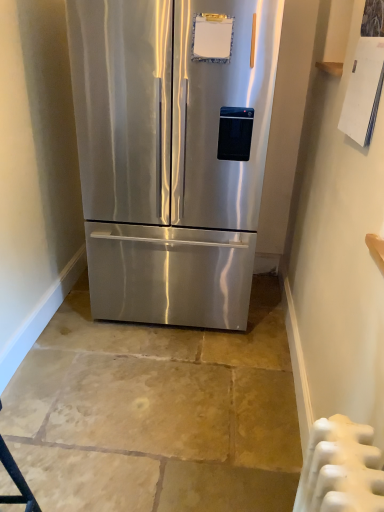
Image resolution: width=384 pixels, height=512 pixels. I want to click on free space in front of stainless steel refrigerator at center, so 193,388.